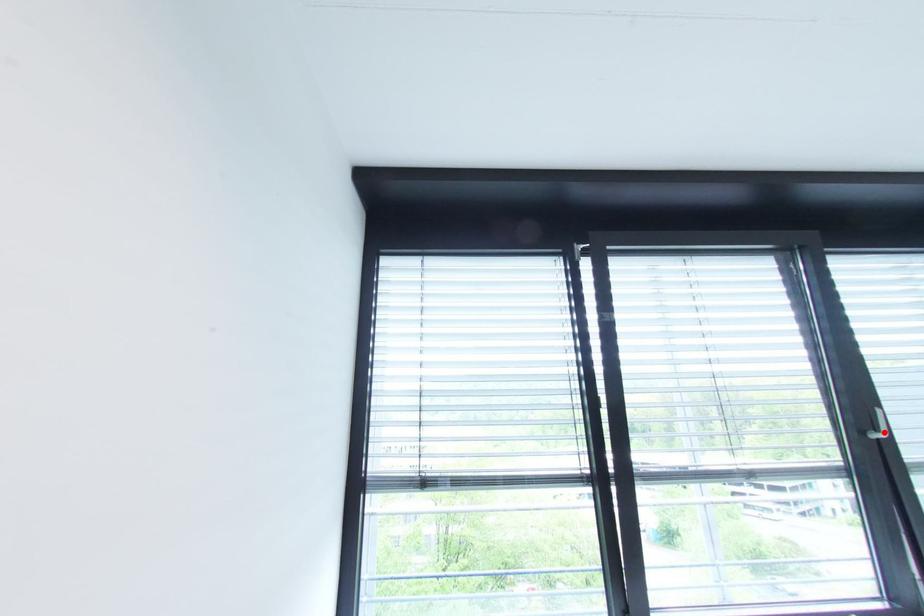
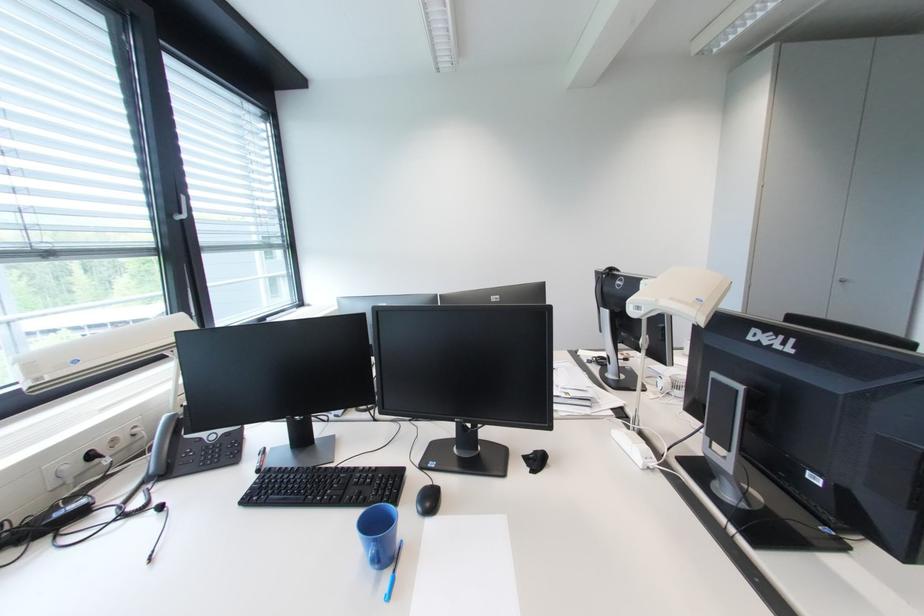
Question: I am providing you with two images of the same scene from different viewpoints. A red point is shown in image1. For the corresponding object point in image2, is it positioned nearer or farther from the camera?

Choices:
 (A) Nearer
 (B) Farther

Answer: (B)